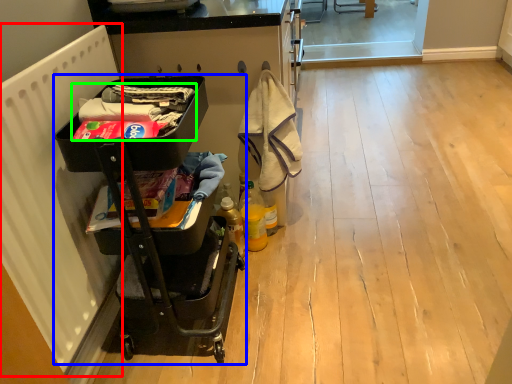
Question: Which object is the farthest from radiator (highlighted by a red box)? Choose among these: baby carriage (highlighted by a blue box) or laundry (highlighted by a green box).

Choices:
 (A) baby carriage
 (B) laundry

Answer: (B)